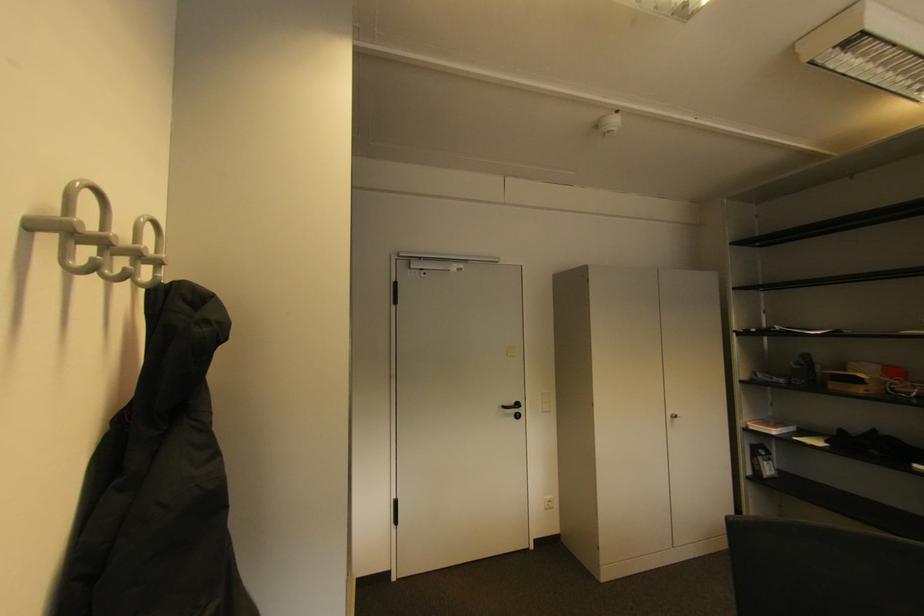
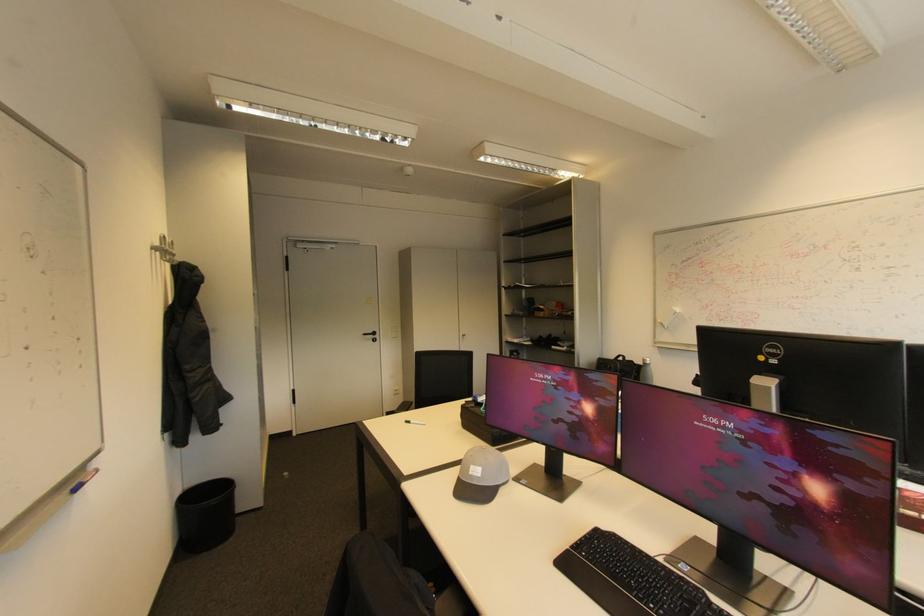
In a continuous first-person perspective shot, in which direction is the camera moving?

The cameraman moved toward right, backward.